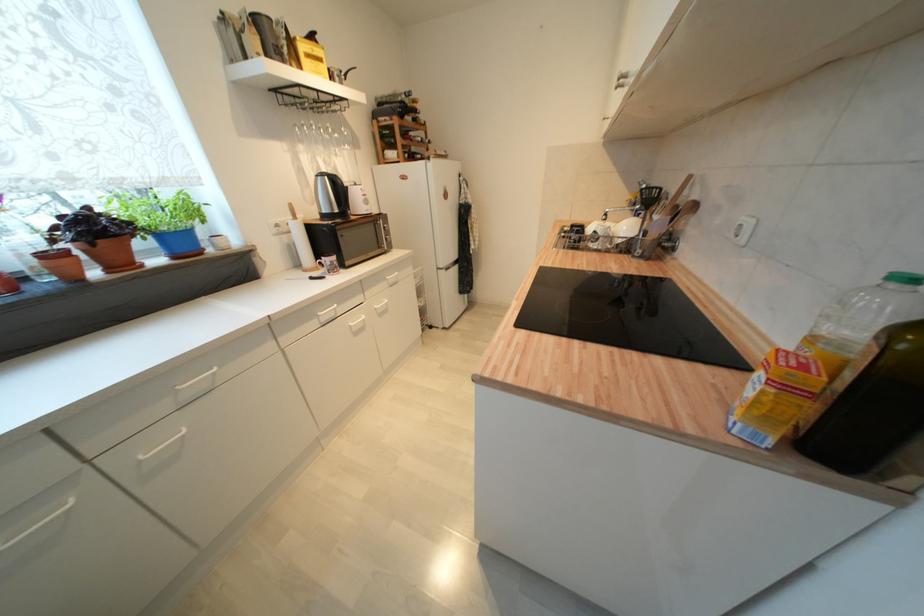
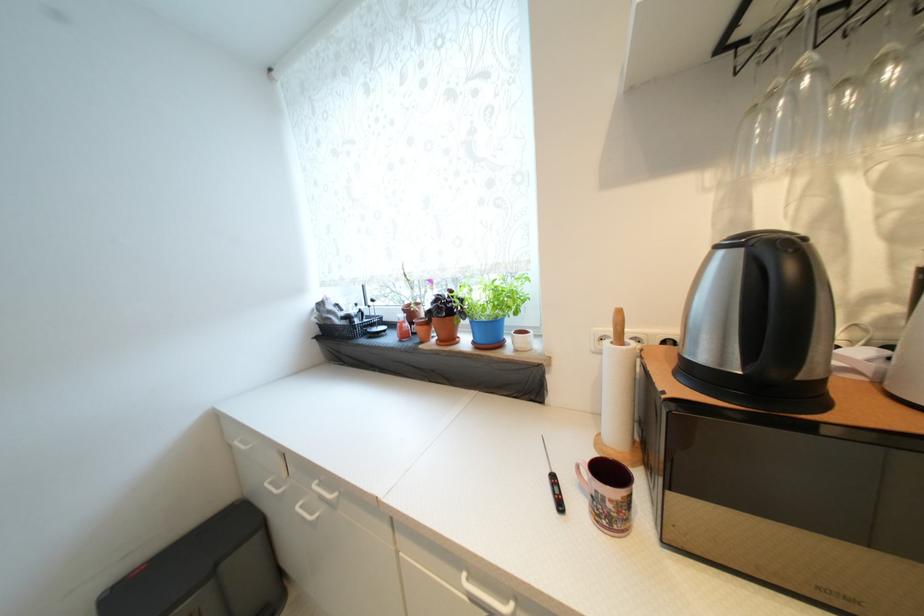
Locate, in the second image, the point that corresponds to [322,177] in the first image.

(723, 249)